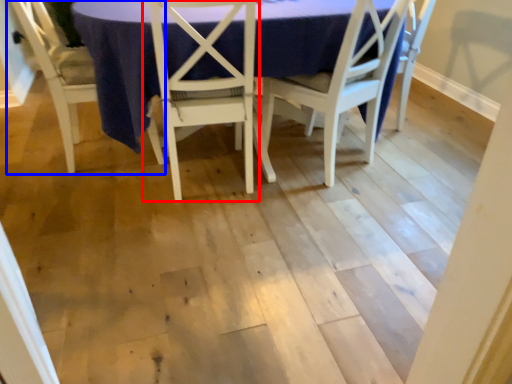
Question: Among these objects, which one is farthest to the camera, chair (highlighted by a red box) or chair (highlighted by a blue box)?

Choices:
 (A) chair
 (B) chair

Answer: (B)